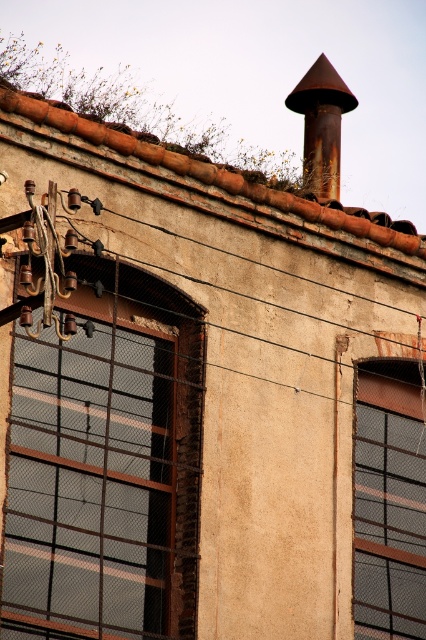
Who is positioned more to the left, brown metal window at left or rusty metal roof at upper center?

brown metal window at left

From the picture: Is brown metal window at left taller than rusty metal roof at upper center?

Indeed, brown metal window at left has a greater height compared to rusty metal roof at upper center.

Measure the distance between brown metal window at left and camera.

brown metal window at left and camera are 31.60 meters apart from each other.

Find the location of `brown metal window at left`. brown metal window at left is located at coordinates (104, 464).

Looking at this image, which of these two, rusty metal roof at upper center or rusty metal chimney at upper center, stands shorter?

Standing shorter between the two is rusty metal roof at upper center.

Find the location of a particular element. This screenshot has height=640, width=426. rusty metal roof at upper center is located at coordinates point(244,195).

Who is shorter, brown metal window at left or matte glass window at center?

matte glass window at center is shorter.

In the scene shown: Can you confirm if brown metal window at left is thinner than matte glass window at center?

In fact, brown metal window at left might be wider than matte glass window at center.

Between point (98, 385) and point (371, 429), which one is positioned behind?

Positioned behind is point (371, 429).

What are the coordinates of `brown metal window at left` in the screenshot? It's located at (104, 464).